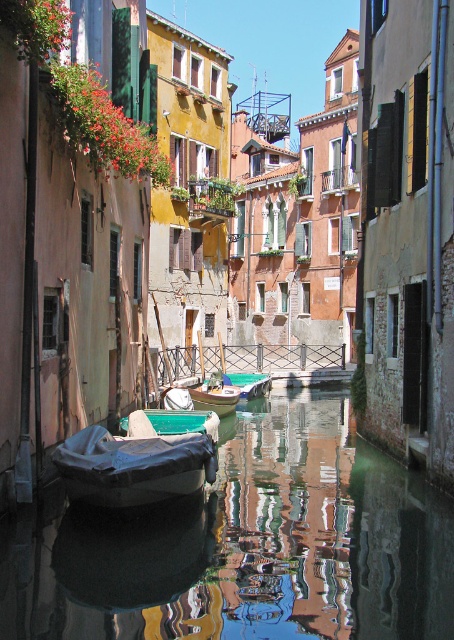
You are standing on a bridge overlooking the canal and want to know how far the point at coordinates (225, 394) is from your current position. Can you determine the distance?

The point at coordinates (225, 394) is 31.59 meters away from your current position.

You are a tourist in Venice and you want to take a photo of the green plastic boat at center. Since the smooth reflective water at center is in the way, can you see the boat in the water?

The smooth reflective water at center is bigger than green plastic boat at center, so the boat can still be seen in the water as it is not completely covered by the water.

You are standing at the edge of the canal and want to take a photo of the smooth reflective water at center. Where should you position yourself to capture the reflection clearly?

To capture the reflection clearly, position yourself directly above the smooth reflective water at center, which is located at point 0.853 on the horizontal axis and 0.542 on the vertical axis.